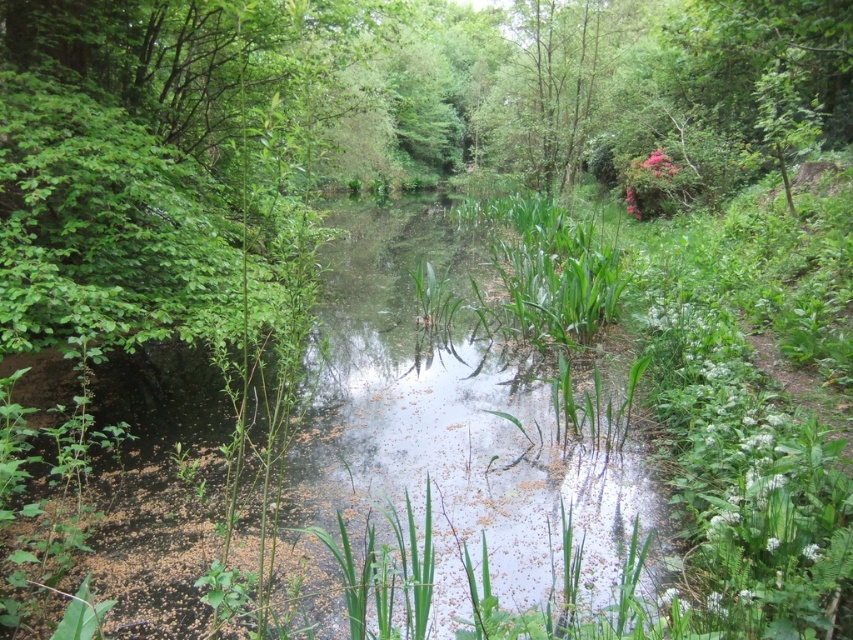
You are standing on the edge of the pond and want to see the reflection of the green leafy tree at upper center in the water. Will you be able to see its reflection in the green leafy water at center?

The green leafy water at center is positioned under the green leafy tree at upper center, so yes, you can see its reflection in the water.

You are standing at point (451, 428) in the serene natural scene. What do you see around you?

You are standing at point (451, 428) where green leafy water at center is located. The area is surrounded by lush greenery and a shallow pond with floating debris, creating a natural and serene environment.